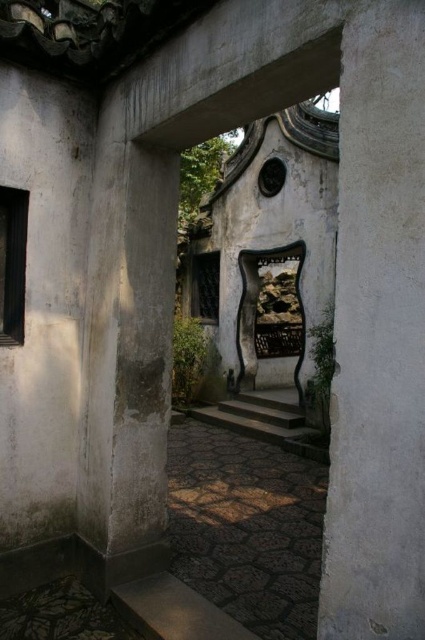
Does point (343, 52) come behind point (243, 422)?

No, (343, 52) is closer to viewer.

Measure the distance from white concrete pillar at right to dark gray stone stairs at center.

white concrete pillar at right and dark gray stone stairs at center are 19.73 feet apart.

Is point (399, 548) positioned before point (289, 445)?

Yes, point (399, 548) is closer to viewer.

This screenshot has height=640, width=425. Identify the location of white concrete pillar at right. (377, 333).